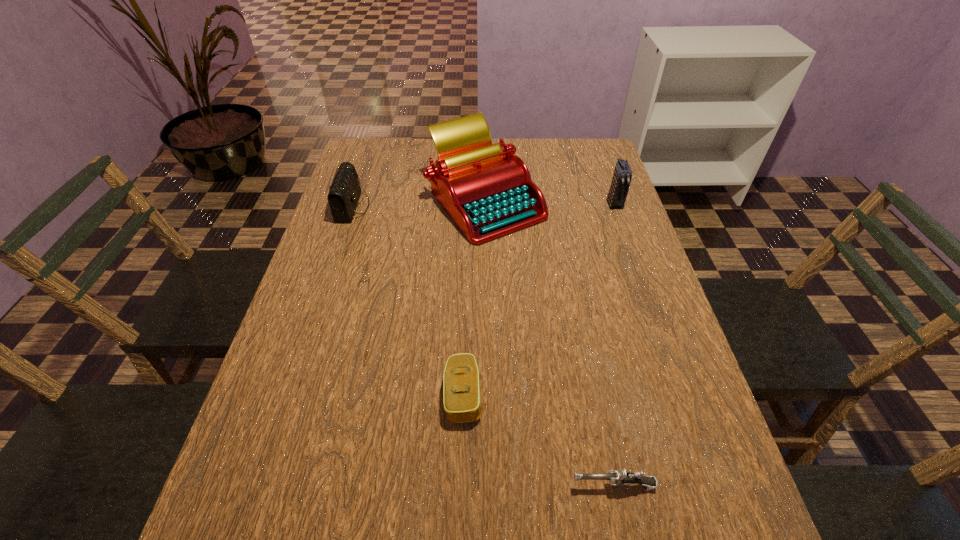
Where is `free space located on the front flap of the third shortest object`? Image resolution: width=960 pixels, height=540 pixels. free space located on the front flap of the third shortest object is located at coordinates (462, 207).

This screenshot has width=960, height=540. In order to click on vacant space located 0.170m on the zipper side of the second nearest object in this screenshot , I will do `click(565, 395)`.

I want to click on vacant region located aimed along the barrel of the nearest object, so click(348, 485).

Where is `blank space located 0.350m aimed along the barrel of the nearest object`? Image resolution: width=960 pixels, height=540 pixels. blank space located 0.350m aimed along the barrel of the nearest object is located at coordinates (372, 485).

Image resolution: width=960 pixels, height=540 pixels. Find the location of `free space located 0.150m aimed along the barrel of the nearest object`. free space located 0.150m aimed along the barrel of the nearest object is located at coordinates (486, 485).

Where is `object that is at the far edge`? Image resolution: width=960 pixels, height=540 pixels. object that is at the far edge is located at coordinates (487, 190).

The image size is (960, 540). In order to click on object positioned at the left edge in this screenshot , I will do `click(344, 192)`.

In order to click on clutch bag present at the right edge in this screenshot , I will do `click(622, 175)`.

Where is `gun that is positioned at the right edge`? Image resolution: width=960 pixels, height=540 pixels. gun that is positioned at the right edge is located at coordinates (616, 477).

In the image, there is a desktop. Identify the location of vacant space at the far edge. The image size is (960, 540). (420, 161).